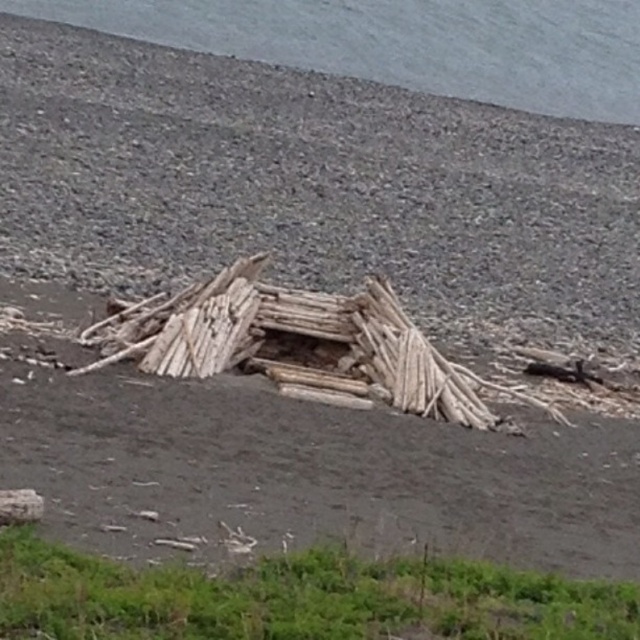
Question: Is gray water at upper center to the right of natural wood driftwood at center from the viewer's perspective?

Choices:
 (A) yes
 (B) no

Answer: (A)

Question: Among these objects, which one is farthest from the camera?

Choices:
 (A) natural wood shelter at center
 (B) gray water at upper center

Answer: (B)

Question: Can you confirm if natural wood shelter at center is bigger than gray water at upper center?

Choices:
 (A) yes
 (B) no

Answer: (B)

Question: Which object is positioned closest to the gray water at upper center?

Choices:
 (A) natural wood shelter at center
 (B) natural wood driftwood at center

Answer: (B)

Question: Does natural wood shelter at center appear over gray water at upper center?

Choices:
 (A) no
 (B) yes

Answer: (A)

Question: Which object is farther from the camera taking this photo?

Choices:
 (A) gray water at upper center
 (B) natural wood shelter at center
 (C) natural wood driftwood at center

Answer: (A)